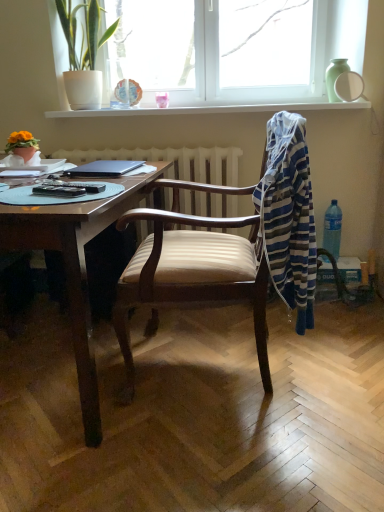
Locate an element on the screen. Image resolution: width=384 pixels, height=512 pixels. free area below wooden desk at center (from a real-world perspective) is located at coordinates (62, 360).